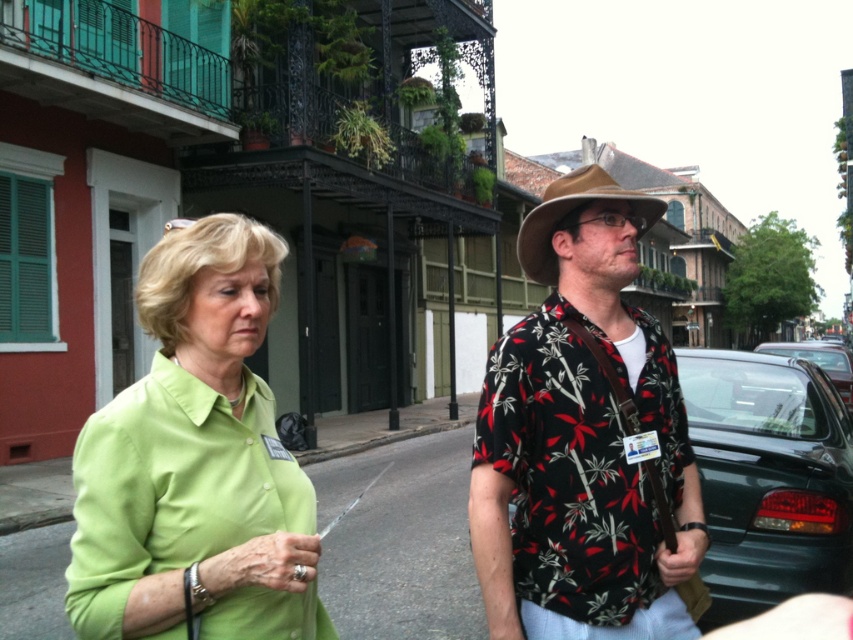
You are a photographer standing at the center of the street, and you want to take a photo of both the point at coordinates point (563, 320) and point (726, 579). Which point should you focus on first to ensure both are in sharp focus?

You should focus on point (563, 320) first because it is closer to the camera than point (726, 579). This ensures that the closer point is in focus, and the farther point will also be within the depth of field if the focus is set correctly.

You are standing in the historic district and want to take a photo of the point at coordinates (567, 241). The camera you have can only focus on objects within 5 feet. Will the point be in focus?

The point at coordinates (567, 241) is 6.86 feet from the camera, which is beyond the 5 feet focusing range. Therefore, the point will not be in focus.